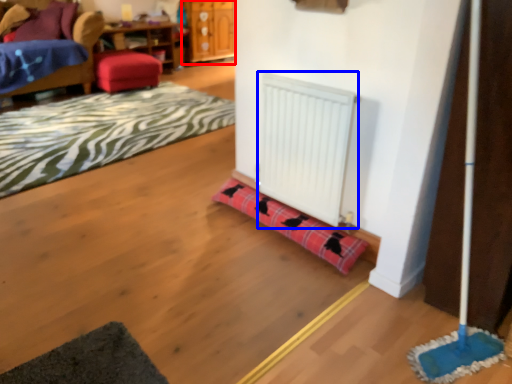
Question: Which point is further to the camera, dresser (highlighted by a red box) or radiator (highlighted by a blue box)?

Choices:
 (A) dresser
 (B) radiator

Answer: (A)